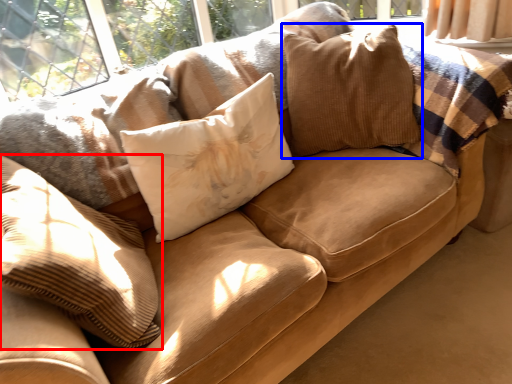
Question: Which of the following is the closest to the observer, pillow (highlighted by a red box) or pillow (highlighted by a blue box)?

Choices:
 (A) pillow
 (B) pillow

Answer: (A)